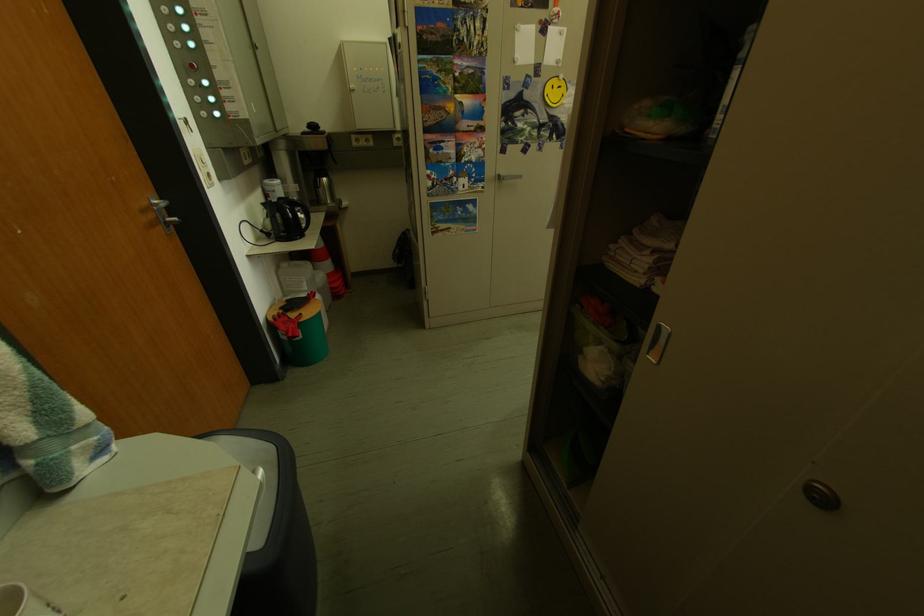
Find where to lift the black kettle handle. Please return your answer as a coordinate pair (x, y).

(296, 212)